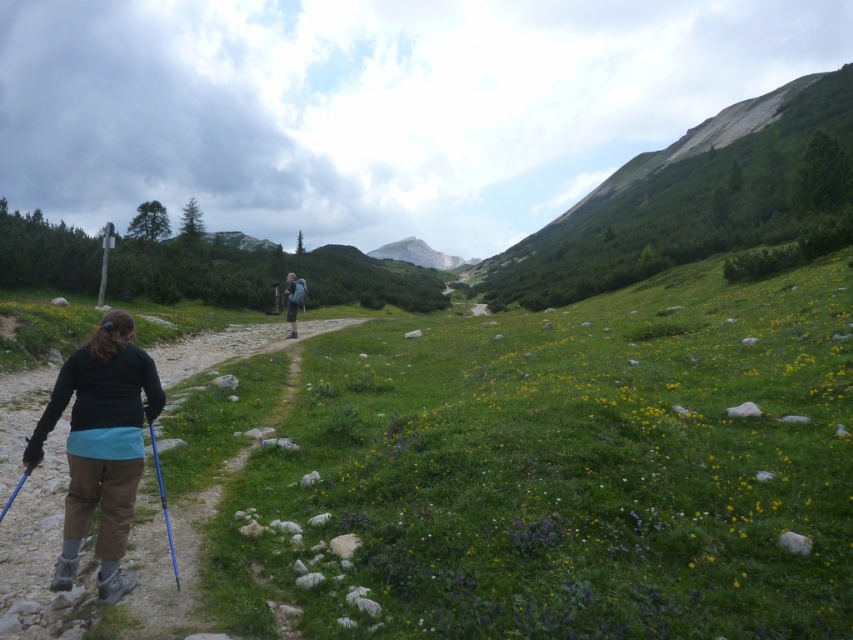
Question: Does blue plastic ski pole at lower left appear under matte blue backpack at center?

Choices:
 (A) yes
 (B) no

Answer: (A)

Question: Which object appears farthest from the camera in this image?

Choices:
 (A) blue plastic ski pole at lower left
 (B) gravel path at center

Answer: (A)

Question: Which of the following is the closest to the observer?

Choices:
 (A) matte blue backpack at center
 (B) blue plastic ski pole at lower left
 (C) matte black jacket at lower left
 (D) gravel path at center

Answer: (D)

Question: Estimate the real-world distances between objects in this image. Which object is farther from the matte black jacket at lower left?

Choices:
 (A) green grassy hillside at upper right
 (B) blue plastic ski pole at lower left
 (C) matte blue backpack at center
 (D) gravel path at center

Answer: (A)

Question: Where is green grassy hillside at upper right located in relation to matte black jacket at lower left in the image?

Choices:
 (A) below
 (B) above

Answer: (B)

Question: Does matte black jacket at lower left come behind matte blue backpack at center?

Choices:
 (A) yes
 (B) no

Answer: (B)